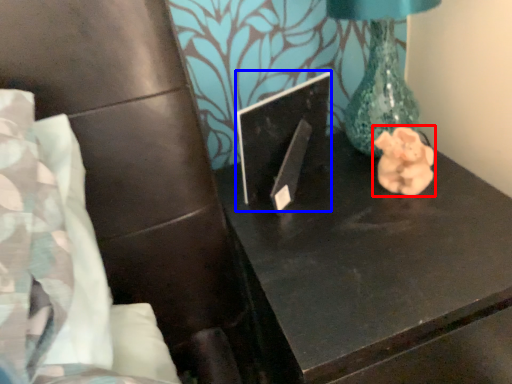
Question: Which of the following is the closest to the observer, animal (highlighted by a red box) or laptop (highlighted by a blue box)?

Choices:
 (A) animal
 (B) laptop

Answer: (B)